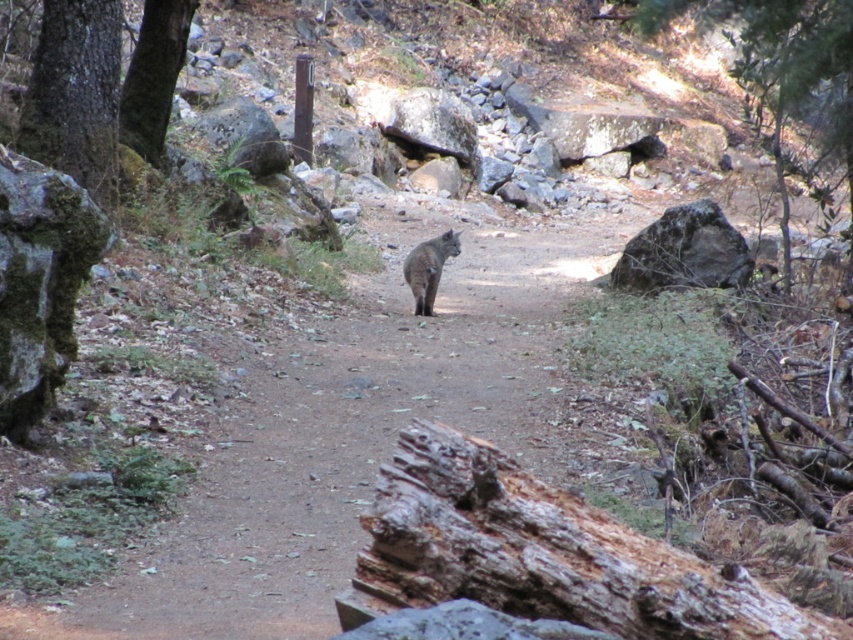
Where is `weathered brown log at lower center`? weathered brown log at lower center is located at coordinates (543, 554).

The image size is (853, 640). In order to click on weathered brown log at lower center in this screenshot , I will do `click(543, 554)`.

Who is shorter, green mossy bark tree at left or fuzzy brown cat at center?

fuzzy brown cat at center

Based on the photo, between green mossy bark tree at left and fuzzy brown cat at center, which one appears on the left side from the viewer's perspective?

green mossy bark tree at left is more to the left.

Does point (41, 54) come in front of point (439, 240)?

Yes, point (41, 54) is in front of point (439, 240).

In order to click on green mossy bark tree at left in this screenshot , I will do [102, 88].

Can you confirm if brown dirt trail at center is taller than green leafy tree at upper right?

Incorrect, brown dirt trail at center's height is not larger of green leafy tree at upper right's.

Is brown dirt trail at center thinner than green leafy tree at upper right?

No.

This screenshot has height=640, width=853. Describe the element at coordinates (346, 442) in the screenshot. I see `brown dirt trail at center` at that location.

Where is `brown dirt trail at center`? brown dirt trail at center is located at coordinates point(346,442).